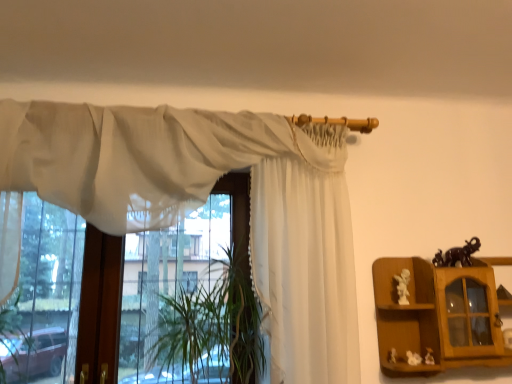
Question: Does white glossy statue at right, the third toy positioned from the bottom, touch wooden cabinet at right?

Choices:
 (A) no
 (B) yes

Answer: (A)

Question: Does white glossy statue at right, the 3th toy from the right, have a greater width compared to wooden cabinet at right?

Choices:
 (A) no
 (B) yes

Answer: (A)

Question: Would you say white glossy statue at right, placed as the 2th toy when sorted from left to right, is outside wooden cabinet at right?

Choices:
 (A) yes
 (B) no

Answer: (B)

Question: From a real-world perspective, does white glossy statue at right, which is the second toy from top to bottom, sit lower than wooden cabinet at right?

Choices:
 (A) no
 (B) yes

Answer: (A)

Question: Could you tell me if white glossy statue at right, placed as the 2th toy when sorted from left to right, is turned towards wooden cabinet at right?

Choices:
 (A) yes
 (B) no

Answer: (A)

Question: Does white glossy statue at right, placed as the 2th toy when sorted from left to right, come in front of wooden cabinet at right?

Choices:
 (A) yes
 (B) no

Answer: (B)

Question: Is sheer white curtain at upper center, the first curtain positioned from the left, with white glossy statue at right, the 3th toy from the right?

Choices:
 (A) no
 (B) yes

Answer: (A)

Question: From a real-world perspective, is sheer white curtain at upper center, the first curtain positioned from the left, on white glossy statue at right, which is the second toy from top to bottom?

Choices:
 (A) no
 (B) yes

Answer: (B)

Question: Is sheer white curtain at upper center, positioned as the second curtain in right-to-left order, at the right side of white glossy statue at right, placed as the 2th toy when sorted from left to right?

Choices:
 (A) no
 (B) yes

Answer: (A)

Question: Can you confirm if sheer white curtain at upper center, the first curtain positioned from the left, is smaller than white glossy statue at right, the 3th toy from the right?

Choices:
 (A) no
 (B) yes

Answer: (A)

Question: Considering the relative sizes of sheer white curtain at upper center, the first curtain positioned from the left, and white glossy statue at right, placed as the 2th toy when sorted from left to right, in the image provided, is sheer white curtain at upper center, the first curtain positioned from the left, shorter than white glossy statue at right, placed as the 2th toy when sorted from left to right,?

Choices:
 (A) yes
 (B) no

Answer: (B)

Question: Does sheer white curtain at upper center, the first curtain positioned from the left, have a greater height compared to white glossy statue at right, the third toy positioned from the bottom?

Choices:
 (A) no
 (B) yes

Answer: (B)

Question: Considering the relative sizes of white glossy statue at right, placed as the 2th toy when sorted from left to right, and sheer white curtain at upper center, positioned as the second curtain in right-to-left order, in the image provided, is white glossy statue at right, placed as the 2th toy when sorted from left to right, wider than sheer white curtain at upper center, positioned as the second curtain in right-to-left order,?

Choices:
 (A) yes
 (B) no

Answer: (B)